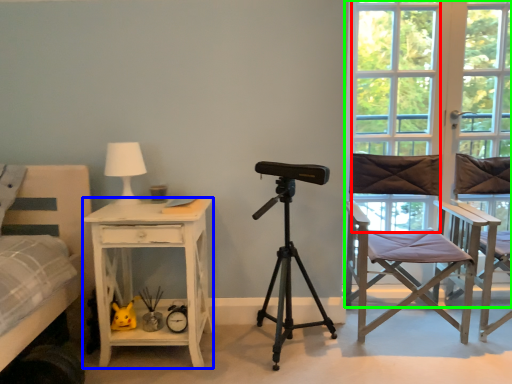
Question: Based on their relative distances, which object is nearer to window (highlighted by a red box)? Choose from desk (highlighted by a blue box) and window frame (highlighted by a green box).

Choices:
 (A) desk
 (B) window frame

Answer: (B)